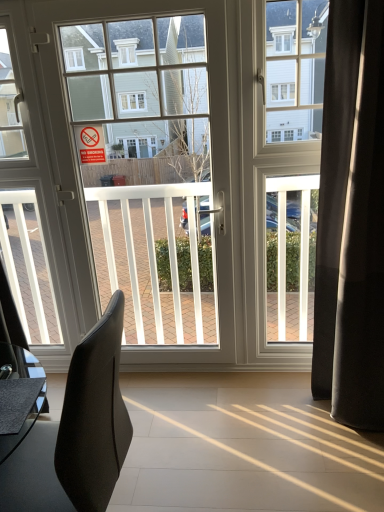
In order to face black fabric curtain at right, should I rotate leftwards or rightwards?

Turn right by 22.364 degrees to look at black fabric curtain at right.

What do you see at coordinates (187, 176) in the screenshot? I see `white glossy door at center` at bounding box center [187, 176].

In order to click on black leather chair at left in this screenshot , I will do `click(76, 433)`.

This screenshot has width=384, height=512. What are the coordinates of `black fabric curtain at right` in the screenshot? It's located at (351, 219).

Between white glossy door at center and red paper sign at upper left, which one has more height?

With more height is white glossy door at center.

Is white glossy door at center positioned with its back to red paper sign at upper left?

Yes, white glossy door at center is facing away from red paper sign at upper left.

Locate an element on the screen. The width and height of the screenshot is (384, 512). door beneath the red paper sign at upper left (from a real-world perspective) is located at coordinates (187, 176).

Which is closer to the camera, (195,318) or (75,136)?

Clearly, point (195,318) is more distant from the camera than point (75,136).

This screenshot has height=512, width=384. In order to click on door above the black fabric curtain at right (from the image's perspective) in this screenshot , I will do point(187,176).

Between point (141, 188) and point (375, 270), which one is positioned behind?

The point (141, 188) is farther.

Can you confirm if white glossy door at center is positioned to the left of black fabric curtain at right?

Correct, you'll find white glossy door at center to the left of black fabric curtain at right.

Considering the sizes of objects black leather chair at left and red paper sign at upper left in the image provided, who is smaller, black leather chair at left or red paper sign at upper left?

red paper sign at upper left is smaller.

Which is behind, black leather chair at left or red paper sign at upper left?

red paper sign at upper left.

Is black leather chair at left situated inside red paper sign at upper left or outside?

black leather chair at left cannot be found inside red paper sign at upper left.

Between red paper sign at upper left and white glossy door at center, which one has less height?

Standing shorter between the two is red paper sign at upper left.

How far apart are red paper sign at upper left and white glossy door at center?

red paper sign at upper left and white glossy door at center are 28.23 inches apart.

Can we say red paper sign at upper left lies outside white glossy door at center?

Answer: Actually, red paper sign at upper left is at least partially inside white glossy door at center.

Which is nearer, (77,141) or (201,196)?

Point (77,141) is closer to the camera than point (201,196).

Considering the relative sizes of black leather chair at left and black fabric curtain at right in the image provided, is black leather chair at left shorter than black fabric curtain at right?

Yes.

Which is further, (9,495) or (365,367)?

The point (365,367) is more distant.

Can you confirm if black leather chair at left is bigger than black fabric curtain at right?

Indeed, black leather chair at left has a larger size compared to black fabric curtain at right.

How many degrees apart are the facing directions of black leather chair at left and black fabric curtain at right?

The angle between the facing direction of black leather chair at left and the facing direction of black fabric curtain at right is 94.4 degrees.

Which of these two, black fabric curtain at right or white glossy door at center, stands shorter?

black fabric curtain at right is shorter.

Which is more to the left, black fabric curtain at right or white glossy door at center?

Positioned to the left is white glossy door at center.

From a real-world perspective, does black fabric curtain at right sit lower than white glossy door at center?

Correct, in the physical world, black fabric curtain at right is lower than white glossy door at center.

Is black fabric curtain at right oriented away from white glossy door at center?

No, black fabric curtain at right's orientation is not away from white glossy door at center.

Does point (318, 28) lie in front of point (115, 401)?

No, it is behind (115, 401).

In the image, is white glossy door at center positioned in front of or behind black leather chair at left?

Visually, white glossy door at center is located behind black leather chair at left.

The width and height of the screenshot is (384, 512). Find the location of `chair to the left of white glossy door at center`. chair to the left of white glossy door at center is located at coordinates (76, 433).

From the image's perspective, would you say white glossy door at center is positioned over black leather chair at left?

Yes, from the image's perspective, white glossy door at center is above black leather chair at left.

Where is `door below the red paper sign at upper left (from the image's perspective)`? The height and width of the screenshot is (512, 384). door below the red paper sign at upper left (from the image's perspective) is located at coordinates (187, 176).

Locate an element on the screen. door above the black fabric curtain at right (from the image's perspective) is located at coordinates (187, 176).

Based on their spatial positions, is black leather chair at left or red paper sign at upper left closer to white glossy door at center?

red paper sign at upper left is closer to white glossy door at center.

Considering their positions, is black leather chair at left positioned further to red paper sign at upper left than white glossy door at center?

The object further to red paper sign at upper left is black leather chair at left.

When comparing their distances from black leather chair at left, does red paper sign at upper left or black fabric curtain at right seem closer?

black fabric curtain at right is positioned closer to the anchor black leather chair at left.

Consider the image. Considering their positions, is black fabric curtain at right positioned closer to black leather chair at left than red paper sign at upper left?

black fabric curtain at right is positioned closer to the anchor black leather chair at left.

Which object lies further to the anchor point black fabric curtain at right, red paper sign at upper left or white glossy door at center?

The object further to black fabric curtain at right is red paper sign at upper left.

When comparing their distances from white glossy door at center, does red paper sign at upper left or black leather chair at left seem further?

black leather chair at left is further to white glossy door at center.

Looking at the image, which one is located further to red paper sign at upper left, white glossy door at center or black leather chair at left?

black leather chair at left is positioned further to the anchor red paper sign at upper left.

Looking at the image, which one is located closer to black leather chair at left, red paper sign at upper left or white glossy door at center?

white glossy door at center is closer to black leather chair at left.

The height and width of the screenshot is (512, 384). I want to click on door between red paper sign at upper left and black fabric curtain at right, so click(187, 176).

Identify the location of chair located between red paper sign at upper left and black fabric curtain at right in the left-right direction. The height and width of the screenshot is (512, 384). (76, 433).

The image size is (384, 512). I want to click on door located between black leather chair at left and black fabric curtain at right in the left-right direction, so click(x=187, y=176).

This screenshot has height=512, width=384. What are the coordinates of `door located between black leather chair at left and red paper sign at upper left in the depth direction` in the screenshot? It's located at pyautogui.click(x=187, y=176).